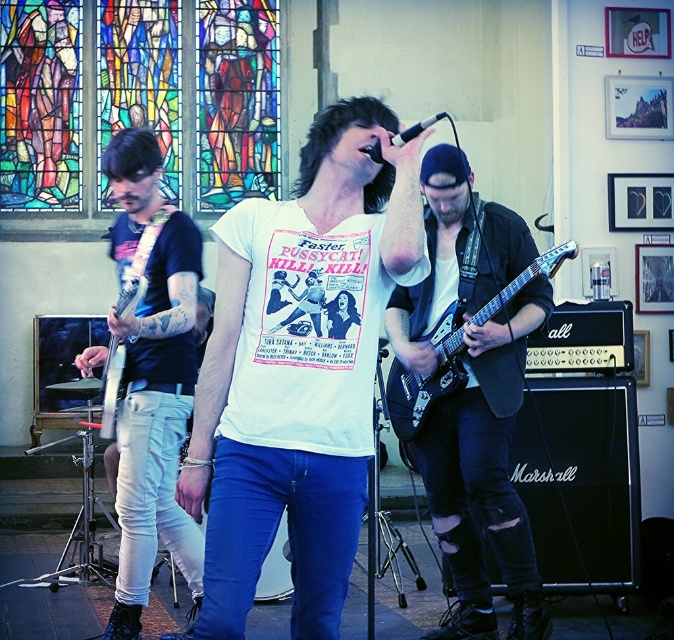
You are a stagehand setting up for a concert. You need to place a stand that requires at least 1.2 meters of vertical space. Given the information about the guitars, can you determine if the stand will fit between the matte black guitar at center and the metallic silver electric guitar at left?

The matte black guitar at center is taller than the metallic silver electric guitar at left, but the exact height isn t provided. Without knowing the specific measurements, it s impossible to confirm if the stand will fit. Additional information is needed to determine the vertical space available between them.

You are a photographer positioned at the front of the stage. You want to take a photo of both the matte black guitar at center and the metallic silver electric guitar at left. Which guitar will appear larger in your photo?

The matte black guitar at center will appear larger in the photo because it is closer to the viewer than the metallic silver electric guitar at left.